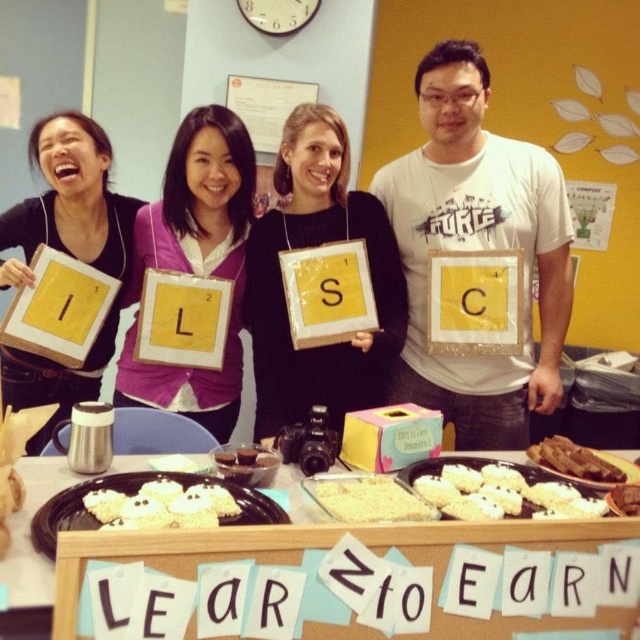
Between point (548, 333) and point (52, 460), which one is positioned behind?

The point (548, 333) is more distant.

Does white matte t-shirt at center appear on the right side of white cardboard sign at center?

Indeed, white matte t-shirt at center is positioned on the right side of white cardboard sign at center.

This screenshot has height=640, width=640. Describe the element at coordinates (477, 250) in the screenshot. I see `white matte t-shirt at center` at that location.

Locate an element on the screen. The width and height of the screenshot is (640, 640). white matte t-shirt at center is located at coordinates (477, 250).

I want to click on white fluffy cookies at lower center, so click(x=163, y=506).

Can you confirm if white fluffy cookies at lower center is wider than brown crispy meat at center?

Yes.

Who is more forward, (124, 528) or (632, 497)?

Point (124, 528) is more forward.

I want to click on white fluffy cookies at lower center, so (163, 506).

Image resolution: width=640 pixels, height=640 pixels. Describe the element at coordinates (477, 250) in the screenshot. I see `white matte t-shirt at center` at that location.

Based on the photo, between white matte t-shirt at center and white frosted cupcake at center, which one is positioned lower?

white frosted cupcake at center

Is point (458, 416) farther from viewer compared to point (268, 451)?

Yes, point (458, 416) is behind point (268, 451).

Identify the location of white matte t-shirt at center. (477, 250).